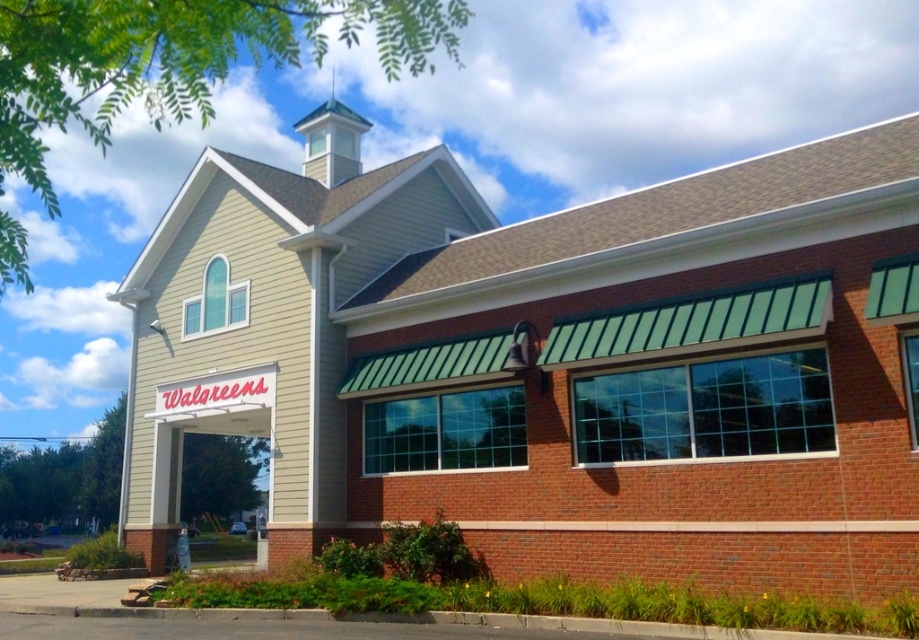
Is point (248, 376) positioned behind point (360, 116)?

No.

Is point (234, 433) farther from camera compared to point (347, 156)?

That is False.

The image size is (919, 640). In order to click on white matte walgreens sign at center in this screenshot , I will do `click(196, 433)`.